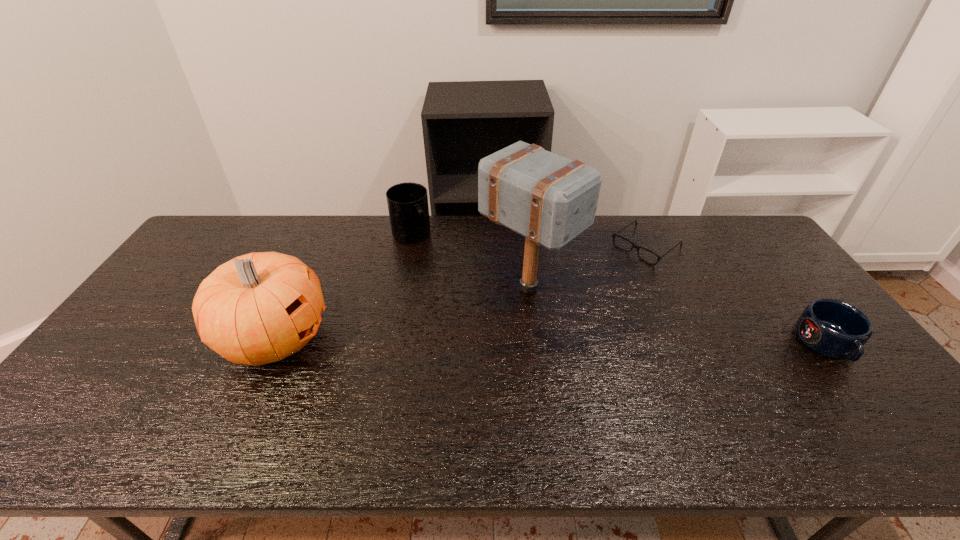
In order to click on free space located 0.370m on the front-facing side of the leftmost object in this screenshot , I will do `click(466, 338)`.

You are a GUI agent. You are given a task and a screenshot of the screen. Output one action in this format:
    pyautogui.click(x=<x>, y=<y>)
    Task: Click on the vacant space located with the handle on the side of the right mug
    Image resolution: width=960 pixels, height=540 pixels.
    Given the screenshot: What is the action you would take?
    pyautogui.click(x=861, y=388)

In order to click on vacant area situated on the striking surface of the third object from left to right in this screenshot , I will do `click(705, 394)`.

Identify the location of vacant space located on the striking surface of the third object from left to right. coord(614,340).

Image resolution: width=960 pixels, height=540 pixels. I want to click on vacant space positioned on the striking surface of the third object from left to right, so click(620, 344).

Find the location of a particular element. This screenshot has height=540, width=960. vacant area situated on the side of the left mug with the handle is located at coordinates (483, 319).

This screenshot has height=540, width=960. In order to click on free space located 0.350m on the side of the left mug with the handle in this screenshot , I will do `click(474, 308)`.

Where is `free region located 0.210m on the side of the left mug with the handle`? free region located 0.210m on the side of the left mug with the handle is located at coordinates (450, 281).

Find the location of a particular element. The width and height of the screenshot is (960, 540). free region located on the front-facing side of the fourth object from left to right is located at coordinates (593, 288).

The width and height of the screenshot is (960, 540). I want to click on free space located 0.390m on the front-facing side of the fourth object from left to right, so click(551, 321).